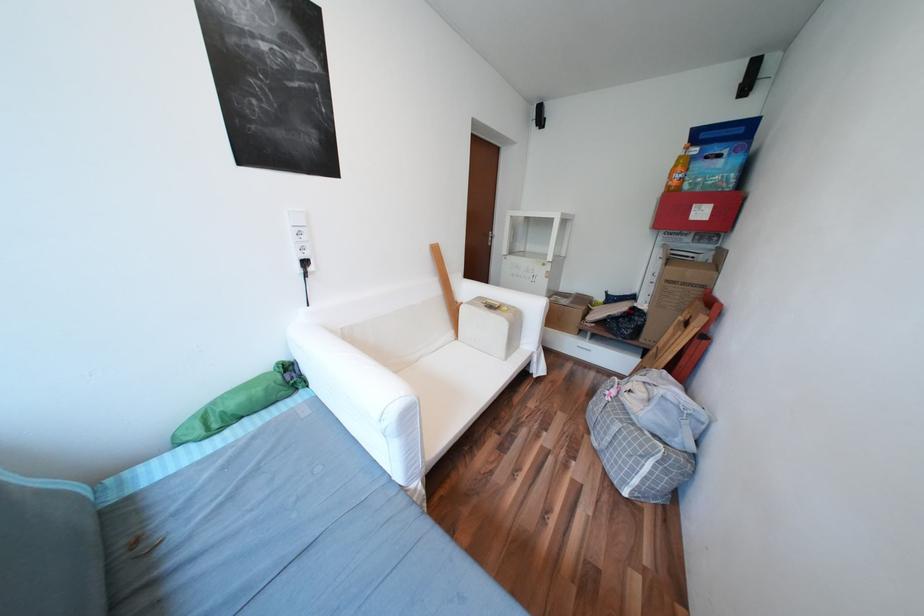
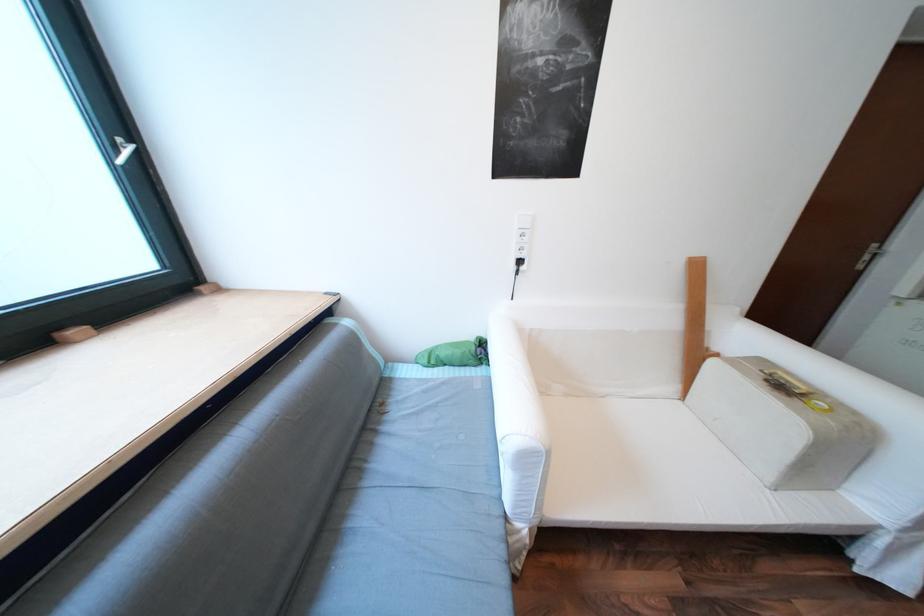
Find the pixel in the second image that matches point 250,416 in the first image.

(455, 365)